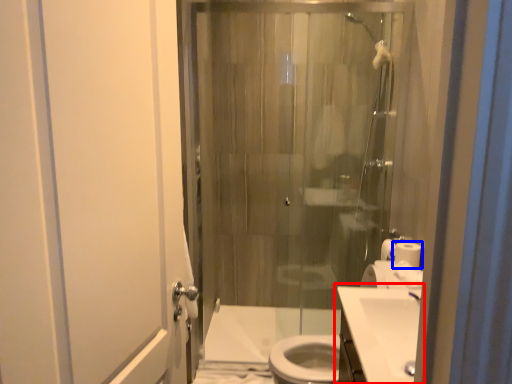
Question: Which point is closer to the camera, sink (highlighted by a red box) or toilet paper (highlighted by a blue box)?

Choices:
 (A) sink
 (B) toilet paper

Answer: (A)